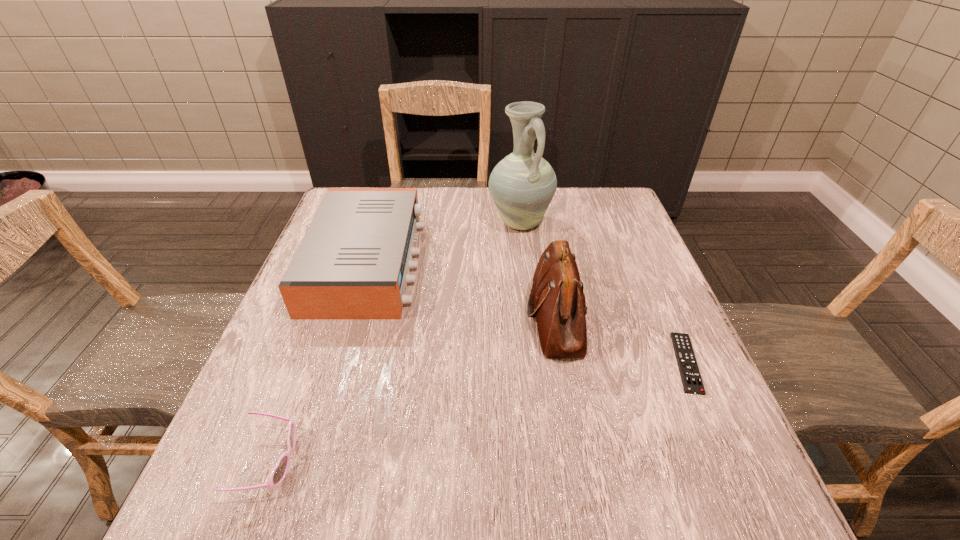
This screenshot has width=960, height=540. I want to click on free area in between the shortest object and the second tallest object, so coord(621,340).

Image resolution: width=960 pixels, height=540 pixels. What are the coordinates of `object that is the second closest one to the pitcher` in the screenshot? It's located at (353, 263).

Where is `object that stands as the fourth closest to the sunglasses`? object that stands as the fourth closest to the sunglasses is located at coordinates (690, 375).

Locate an element on the screen. Image resolution: width=960 pixels, height=540 pixels. free space that satisfies the following two spatial constraints: 1. on the control panel of the second tallest object; 2. on the right side of the third tallest object is located at coordinates (351, 317).

This screenshot has height=540, width=960. Identify the location of free location that satisfies the following two spatial constraints: 1. on the handle side of the tallest object; 2. on the control panel of the third tallest object. (525, 262).

Find the location of `free region that satisfies the following two spatial constraints: 1. on the back side of the second tallest object; 2. on the control panel of the radio receiver`. free region that satisfies the following two spatial constraints: 1. on the back side of the second tallest object; 2. on the control panel of the radio receiver is located at coordinates (546, 262).

What are the coordinates of `free location that satisfies the following two spatial constraints: 1. on the control panel of the third shortest object; 2. on the left side of the shoulder bag` in the screenshot? It's located at (351, 317).

The width and height of the screenshot is (960, 540). What are the coordinates of `blank area in the image that satisfies the following two spatial constraints: 1. on the control panel of the third tallest object; 2. on the back side of the shortest object` in the screenshot? It's located at (338, 363).

Locate an element on the screen. This screenshot has width=960, height=540. blank area in the image that satisfies the following two spatial constraints: 1. on the handle side of the rightmost object; 2. on the left side of the tallest object is located at coordinates (537, 363).

The width and height of the screenshot is (960, 540). Find the location of `free space that satisfies the following two spatial constraints: 1. on the handle side of the tallest object; 2. on the left side of the shoulder bag`. free space that satisfies the following two spatial constraints: 1. on the handle side of the tallest object; 2. on the left side of the shoulder bag is located at coordinates (x=532, y=317).